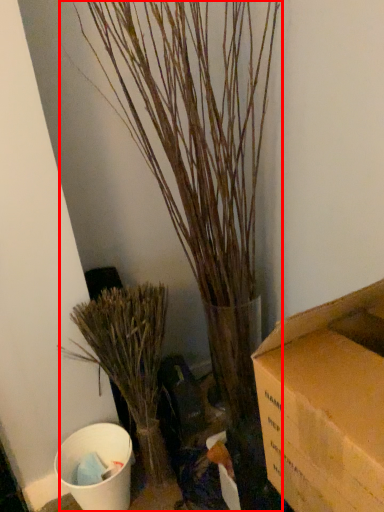
Question: Considering the relative positions of houseplant (annotated by the red box) and houseplant in the image provided, where is houseplant (annotated by the red box) located with respect to the staircase?

Choices:
 (A) left
 (B) right

Answer: (B)